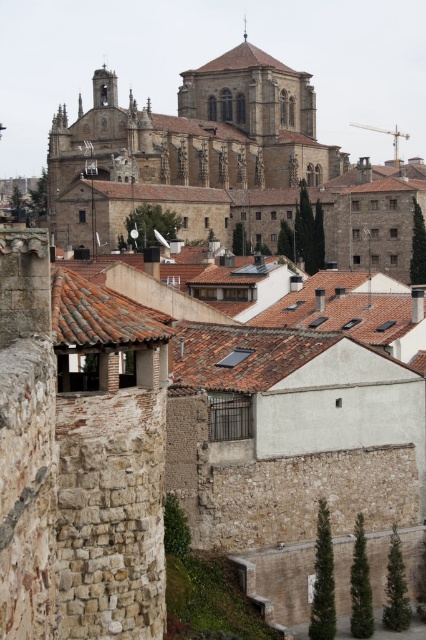
Question: Can you confirm if brown stone church at upper center is wider than terracotta tile roof at center?

Choices:
 (A) yes
 (B) no

Answer: (A)

Question: In this image, where is brown stone church at upper center located relative to terracotta tile roof at center?

Choices:
 (A) below
 (B) above

Answer: (B)

Question: Which of the following is the closest to the observer?

Choices:
 (A) brown stone church at upper center
 (B) terracotta tile roof at center

Answer: (B)

Question: Which point is farther to the camera?

Choices:
 (A) brown stone church at upper center
 (B) terracotta tile roof at center

Answer: (A)

Question: Can you confirm if brown stone church at upper center is positioned to the left of terracotta tile roof at center?

Choices:
 (A) no
 (B) yes

Answer: (A)

Question: Among these points, which one is nearest to the camera?

Choices:
 (A) (103, 312)
 (B) (213, 177)

Answer: (A)